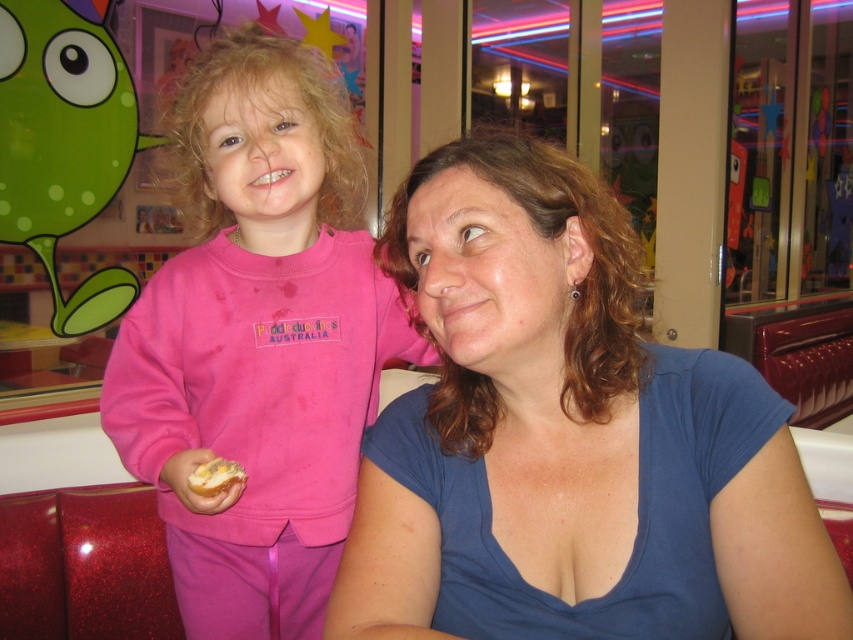
Consider the image. Does blue cotton shirt at center appear on the right side of yellowish bread at lower left?

Correct, you'll find blue cotton shirt at center to the right of yellowish bread at lower left.

Does point (467, 358) come closer to viewer compared to point (225, 468)?

Yes, point (467, 358) is in front of point (225, 468).

The height and width of the screenshot is (640, 853). In order to click on blue cotton shirt at center in this screenshot , I will do `click(564, 426)`.

This screenshot has height=640, width=853. Identify the location of blue cotton shirt at center. (564, 426).

Who is more forward, (498, 348) or (183, 365)?

Positioned in front is point (498, 348).

The width and height of the screenshot is (853, 640). Identify the location of blue cotton shirt at center. (564, 426).

Who is higher up, pink fleece sweatshirt at left or yellowish bread at lower left?

pink fleece sweatshirt at left is above.

Who is positioned more to the left, pink fleece sweatshirt at left or yellowish bread at lower left?

From the viewer's perspective, pink fleece sweatshirt at left appears more on the left side.

This screenshot has height=640, width=853. What do you see at coordinates (258, 340) in the screenshot? I see `pink fleece sweatshirt at left` at bounding box center [258, 340].

At what (x,y) coordinates should I click in order to perform the action: click on pink fleece sweatshirt at left. Please return your answer as a coordinate pair (x, y). Looking at the image, I should click on (258, 340).